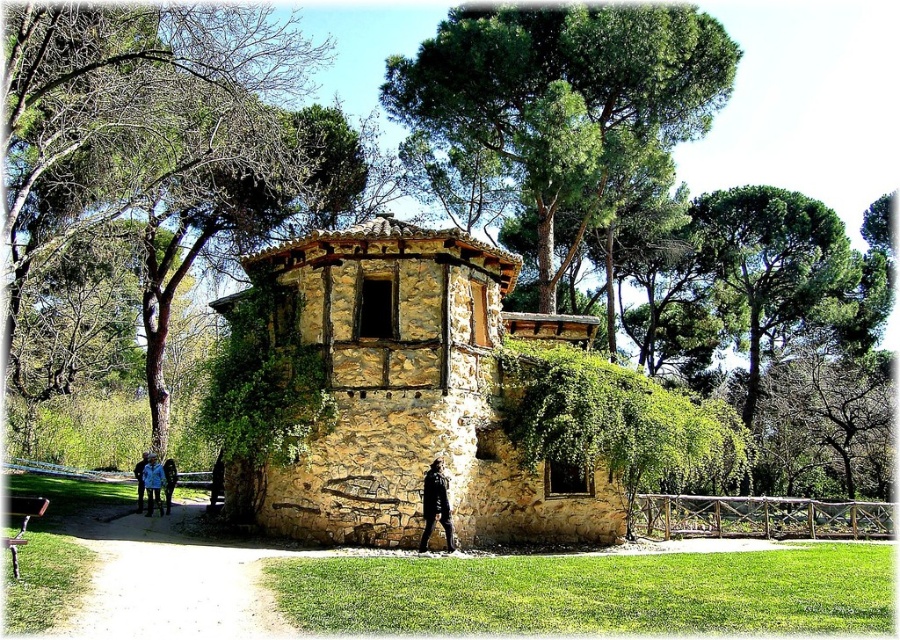
Does brown bark tree at upper left have a lesser width compared to blue denim jacket at lower left?

In fact, brown bark tree at upper left might be wider than blue denim jacket at lower left.

Which is above, brown bark tree at upper left or blue denim jacket at lower left?

Positioned higher is brown bark tree at upper left.

What do you see at coordinates (133, 116) in the screenshot? I see `brown bark tree at upper left` at bounding box center [133, 116].

The height and width of the screenshot is (640, 900). In order to click on brown bark tree at upper left in this screenshot , I will do `click(133, 116)`.

Does point (194, 45) lie in front of point (436, 131)?

Yes, point (194, 45) is in front of point (436, 131).

The image size is (900, 640). Identify the location of brown bark tree at upper left. (133, 116).

Does blue fabric jacket at center have a greater height compared to blue denim jacket at lower left?

No.

Who is taller, blue fabric jacket at center or blue denim jacket at lower left?

With more height is blue denim jacket at lower left.

Locate an element on the screen. The width and height of the screenshot is (900, 640). blue fabric jacket at center is located at coordinates (x=153, y=483).

This screenshot has width=900, height=640. What are the coordinates of `blue fabric jacket at center` in the screenshot? It's located at pyautogui.click(x=153, y=483).